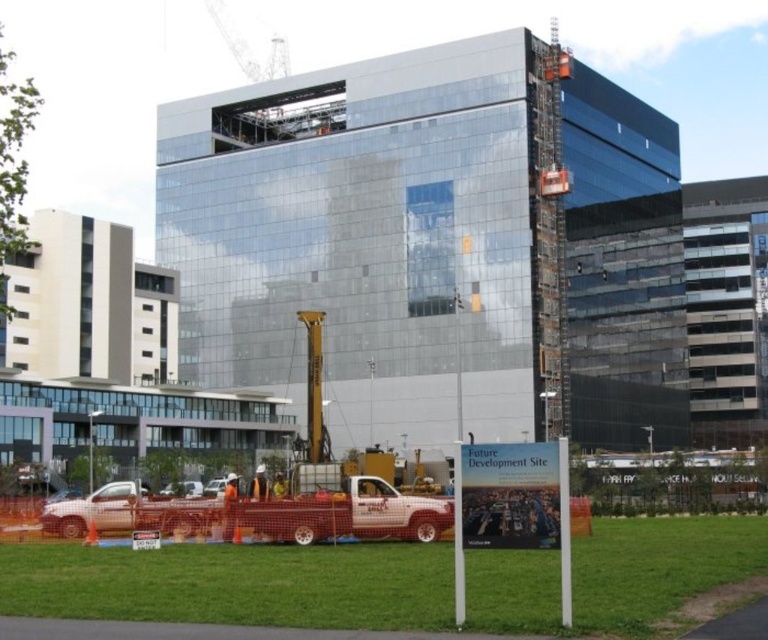
Question: Can you confirm if green grass at lower center is positioned to the left of metallic silver car at lower left?

Choices:
 (A) no
 (B) yes

Answer: (A)

Question: Which point is closer to the camera?

Choices:
 (A) metallic silver car at lower left
 (B) white matte truck at lower center

Answer: (A)

Question: Considering the real-world distances, which object is farthest from the white matte truck at lower left?

Choices:
 (A) green grass at lower center
 (B) metallic silver car at lower left
 (C) white matte truck at lower center

Answer: (A)

Question: Does metallic silver car at lower left have a smaller size compared to white matte truck at lower left?

Choices:
 (A) yes
 (B) no

Answer: (A)

Question: Which object is farther from the camera taking this photo?

Choices:
 (A) green grass at lower center
 (B) white matte truck at lower center
 (C) metallic silver car at lower left

Answer: (B)

Question: Can you confirm if green grass at lower center is wider than metallic silver car at lower left?

Choices:
 (A) no
 (B) yes

Answer: (B)